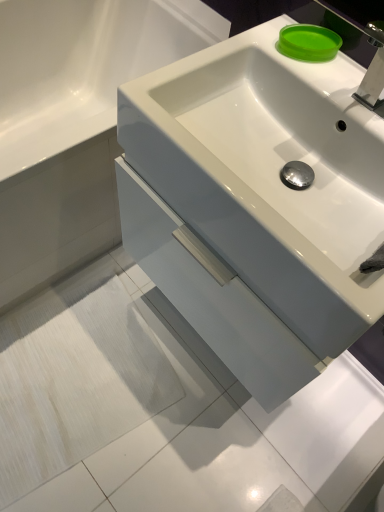
Question: From a real-world perspective, is white glossy cabinet at center over white glossy sink at center?

Choices:
 (A) no
 (B) yes

Answer: (A)

Question: Is white glossy cabinet at center wider than white glossy sink at center?

Choices:
 (A) yes
 (B) no

Answer: (A)

Question: Is white glossy cabinet at center positioned behind white glossy sink at center?

Choices:
 (A) no
 (B) yes

Answer: (B)

Question: Could you tell me if white glossy cabinet at center is facing white glossy sink at center?

Choices:
 (A) yes
 (B) no

Answer: (B)

Question: From the image's perspective, is white glossy cabinet at center located beneath white glossy sink at center?

Choices:
 (A) no
 (B) yes

Answer: (A)

Question: Is the position of white glossy cabinet at center less distant than that of white glossy sink at center?

Choices:
 (A) no
 (B) yes

Answer: (A)

Question: From the image's perspective, is white glossy sink at center on white glossy cabinet at center?

Choices:
 (A) yes
 (B) no

Answer: (B)

Question: Is white glossy sink at center to the right of white glossy cabinet at center from the viewer's perspective?

Choices:
 (A) yes
 (B) no

Answer: (A)

Question: Is white glossy sink at center facing towards white glossy cabinet at center?

Choices:
 (A) yes
 (B) no

Answer: (B)

Question: Is white glossy sink at center located outside white glossy cabinet at center?

Choices:
 (A) no
 (B) yes

Answer: (B)

Question: Is white glossy sink at center smaller than white glossy cabinet at center?

Choices:
 (A) yes
 (B) no

Answer: (A)

Question: Is white glossy sink at center shorter than white glossy cabinet at center?

Choices:
 (A) yes
 (B) no

Answer: (A)

Question: From a real-world perspective, is white glossy sink at center beneath green matte soap at upper right?

Choices:
 (A) no
 (B) yes

Answer: (B)